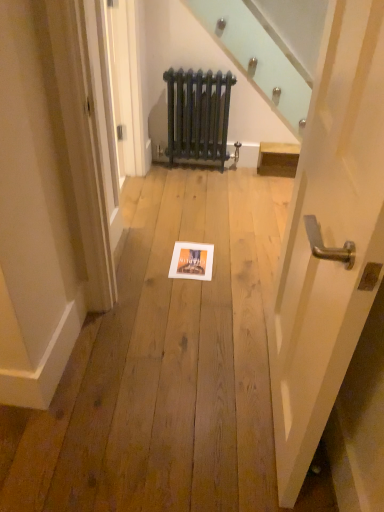
This screenshot has height=512, width=384. I want to click on free spot in front of matte white picture frame at center, so click(188, 286).